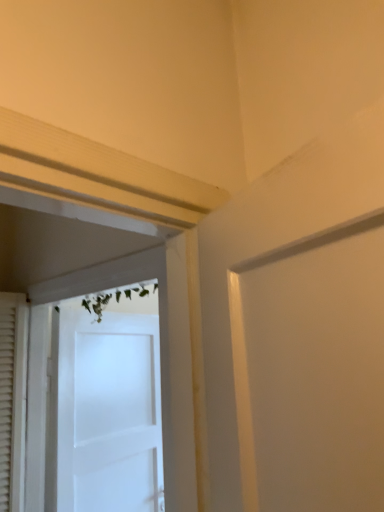
What do you see at coordinates (159, 317) in the screenshot?
I see `white matte door at upper center` at bounding box center [159, 317].

Where is `white matte door at upper center`? white matte door at upper center is located at coordinates (159, 317).

The image size is (384, 512). Identify the location of white matte door at upper center. (159, 317).